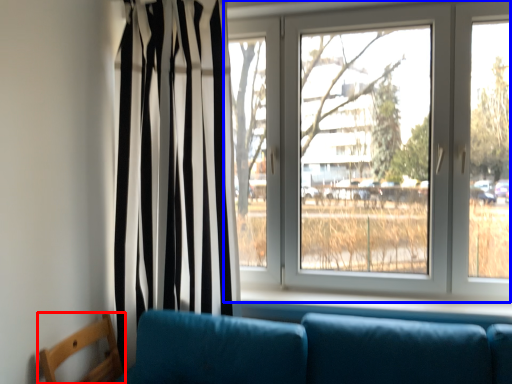
Question: Which point is closer to the camera, furniture (highlighted by a red box) or window (highlighted by a blue box)?

Choices:
 (A) furniture
 (B) window

Answer: (A)